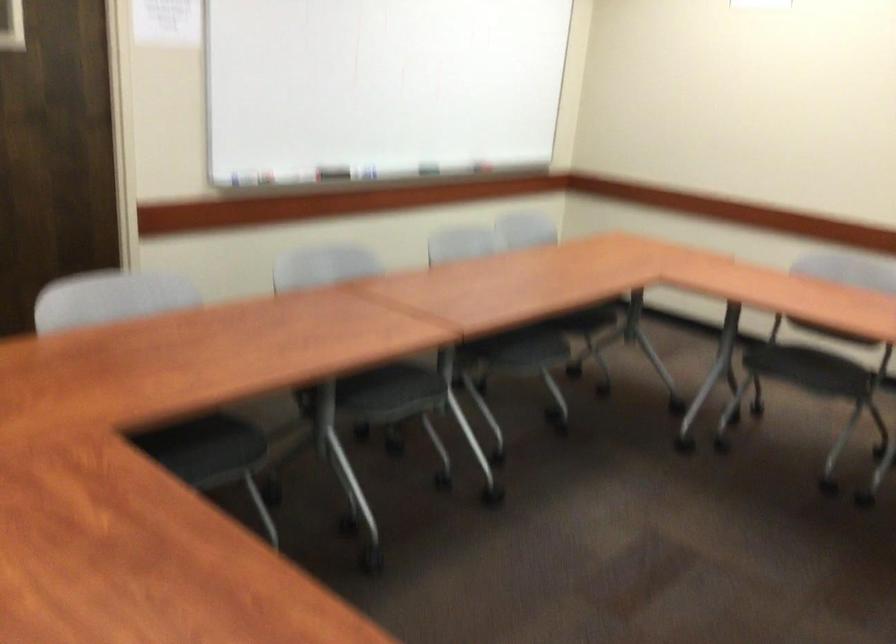
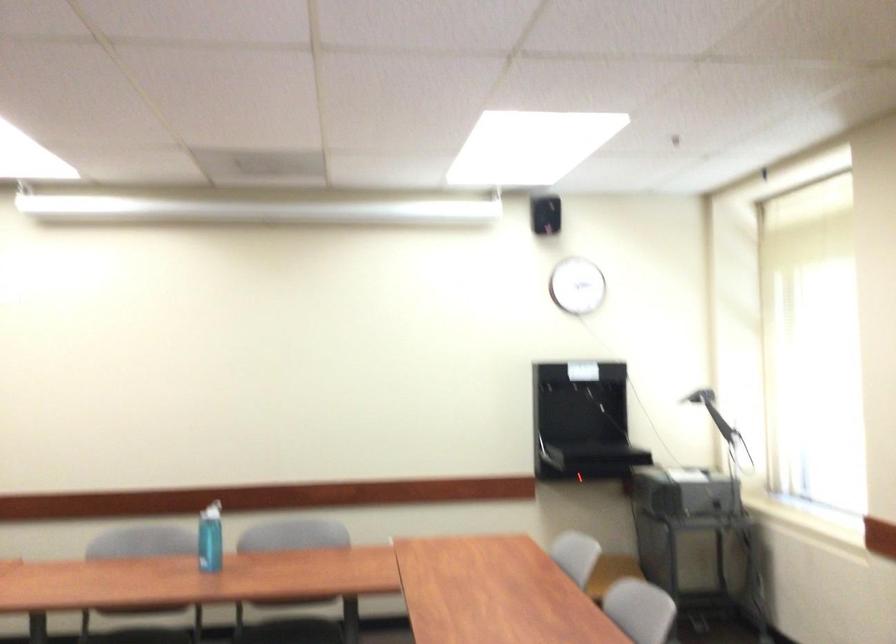
Question: The camera is either moving clockwise (left) or counter-clockwise (right) around the object. The first image is from the beginning of the video and the second image is from the end. Is the camera moving left or right when shooting the video?

Choices:
 (A) Left
 (B) Right

Answer: (A)